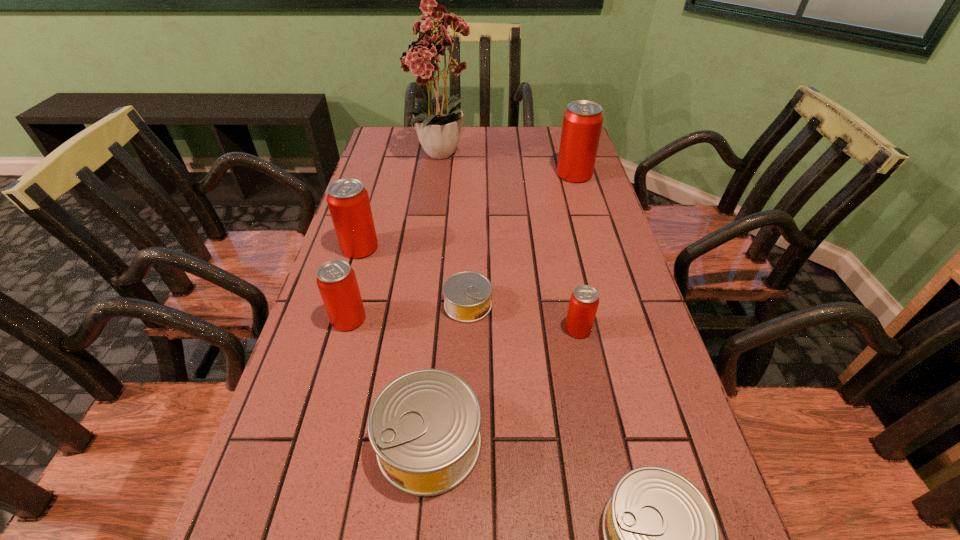
Find the location of `the smallest silver can`. the smallest silver can is located at coordinates (467, 295).

Identify the location of the farthest silver can. The image size is (960, 540). (467, 295).

This screenshot has width=960, height=540. In order to click on free space located on the front-facing side of the flower arrangement in this screenshot , I will do `click(438, 200)`.

Image resolution: width=960 pixels, height=540 pixels. I want to click on vacant region located on the front of the biggest red can, so click(595, 247).

You are a GUI agent. You are given a task and a screenshot of the screen. Output one action in this format:
    pyautogui.click(x=<x>, y=<y>)
    Task: Click on the vacant area situated on the front of the second biggest red can
    
    Given the screenshot: What is the action you would take?
    pyautogui.click(x=321, y=377)

This screenshot has height=540, width=960. Identify the location of free spot located on the right of the fifth shortest object. (522, 319).

Where is `free space located on the back of the smallest red can`? The image size is (960, 540). free space located on the back of the smallest red can is located at coordinates (558, 231).

You are a GUI agent. You are given a task and a screenshot of the screen. Output one action in this format:
    pyautogui.click(x=<x>, y=<y>)
    Task: Click on the vacant space positioned 0.150m on the right of the biggest silver can
    This screenshot has width=960, height=540.
    Given the screenshot: What is the action you would take?
    pyautogui.click(x=568, y=442)

Locate an element on the screen. vacant region located 0.120m on the back of the shortest can is located at coordinates (469, 254).

I want to click on object situated at the far edge, so click(439, 127).